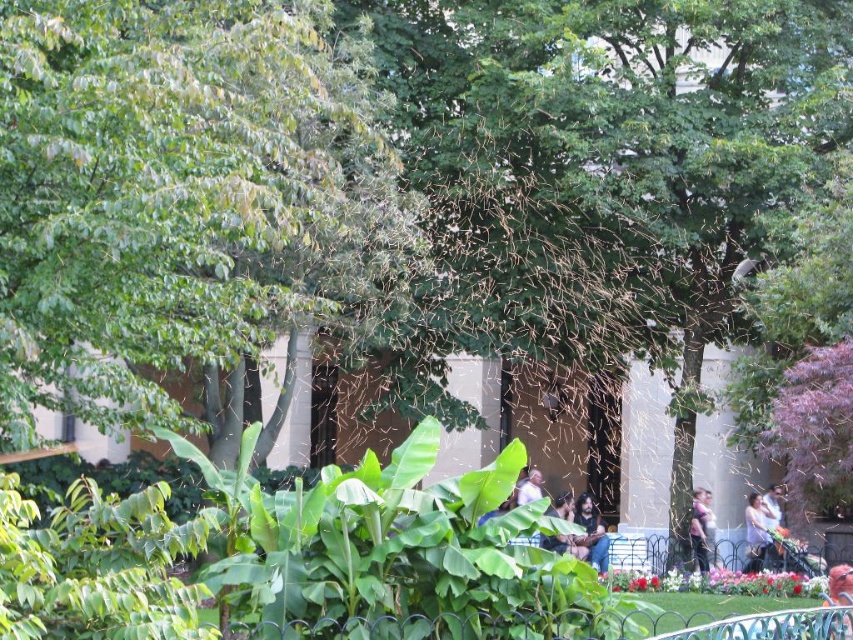
You are a photographer trying to capture the vibrant outdoor scene in the park. You notice a person sitting on the bench at the lower right. Where exactly should you focus your camera to ensure the point at coordinates point (755, 532) is captured clearly?

The point (755, 532) is located on the smooth skin of the person at the lower right. To capture this point clearly, focus your camera on the smooth skin area of the person sitting on the bench at the lower right.

You are standing in the park and see two points marked in the image. Which point is closer to you, point (576,506) or point (762,525)?

Point (576,506) is further to the camera than point (762,525), so point (762,525) is closer to you.

Looking at this image, you are standing in the park and see two points marked in the image. Which point, point (752, 515) or point (700, 502), is closer to you?

Point (752, 515) is closer to the camera than point (700, 502), so it is the closer one.